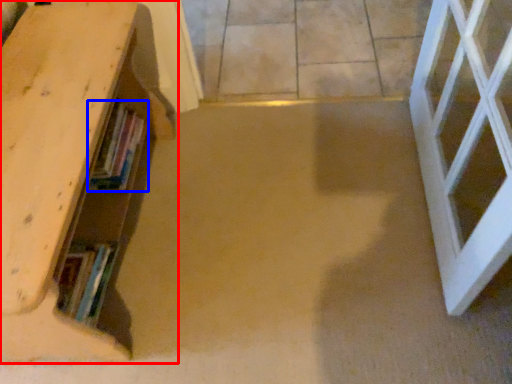
Question: Which point is closer to the camera, shelf (highlighted by a red box) or book (highlighted by a blue box)?

Choices:
 (A) shelf
 (B) book

Answer: (A)